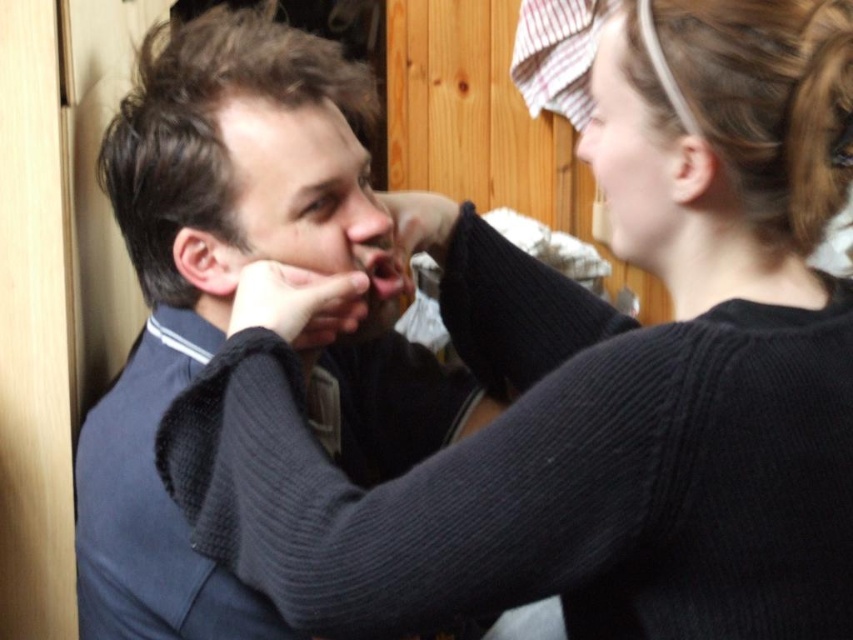
You are a photographer setting up a portrait in a cozy kitchen. You need to ensure that the matte black hair at upper right and the smooth skin nose at center are both visible in the frame. Based on their positions, which object is closer to the right edge of the photo?

The matte black hair at upper right is positioned on the right side of smooth skin nose at center, so it is closer to the right edge of the photo.

You are a photographer trying to capture a candid shot of both the matte black hair at upper right and the black knitted hand at center in the scene. Based on their positions, which object would you need to focus on first to ensure both are in frame?

The matte black hair at upper right is much taller than the black knitted hand at center, so you should focus on the matte black hair at upper right first to ensure both are in frame.

You are designing a poster and need to know the relative sizes of the objects in the image. Which object is wider, the matte black hair at upper right or the black knitted hand at center?

The black knitted hand at center is wider than the matte black hair at upper right.